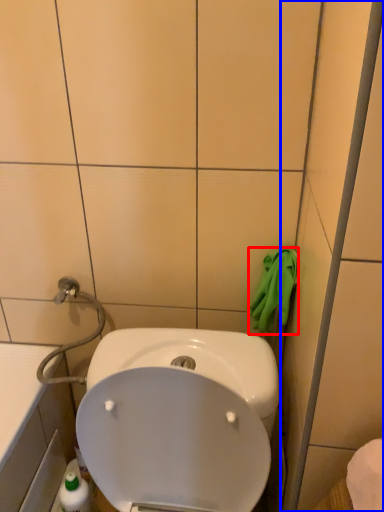
Question: Among these objects, which one is farthest to the camera, hand towel (highlighted by a red box) or glass door (highlighted by a blue box)?

Choices:
 (A) hand towel
 (B) glass door

Answer: (A)